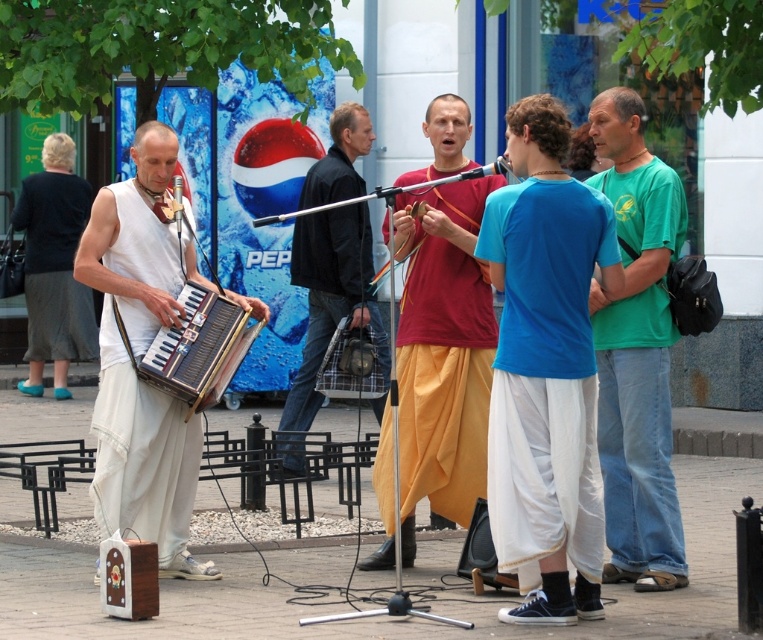
Question: Is dark blue jacket at center smaller than dark gray cotton robe at left?

Choices:
 (A) no
 (B) yes

Answer: (A)

Question: Considering the real-world distances, which object is farthest from the wooden accordion at left?

Choices:
 (A) green cotton t-shirt at right
 (B) dark blue jacket at center

Answer: (B)

Question: Is dark blue jacket at center to the right of dark gray cotton robe at left from the viewer's perspective?

Choices:
 (A) yes
 (B) no

Answer: (A)

Question: Estimate the real-world distances between objects in this image. Which object is closer to the dark blue jacket at center?

Choices:
 (A) maroon fabric dhoti at center
 (B) wooden accordion at left
 (C) green cotton t-shirt at right

Answer: (A)

Question: Which point is farther from the camera taking this photo?

Choices:
 (A) (388, 372)
 (B) (179, 525)

Answer: (A)

Question: Does white cotton dhoti at center have a lesser width compared to white fabric accordion at left?

Choices:
 (A) yes
 (B) no

Answer: (A)